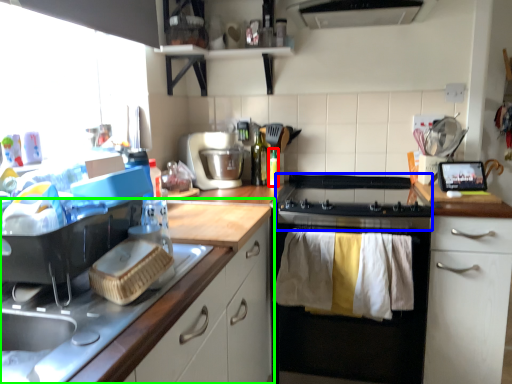
Question: Which is nearer to the bottle (highlighted by a red box)? gas stove (highlighted by a blue box) or cabinetry (highlighted by a green box).

Choices:
 (A) gas stove
 (B) cabinetry

Answer: (A)